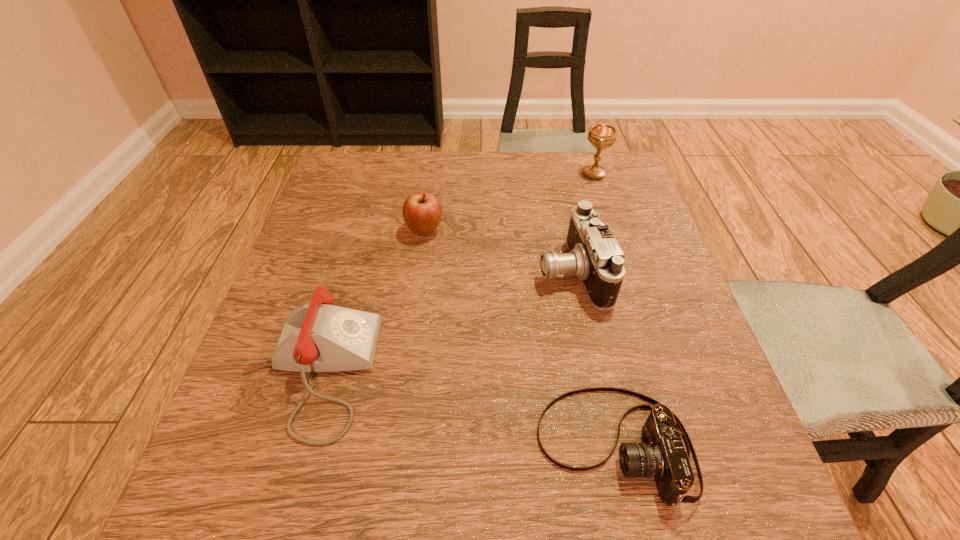
This screenshot has height=540, width=960. Identify the location of the farthest object. (601, 136).

Identify the location of the taller camera. (595, 257).

Where is `the second object from left to right`? the second object from left to right is located at coordinates tap(422, 212).

Where is `telephone`? The height and width of the screenshot is (540, 960). telephone is located at coordinates (320, 337).

At what (x,y) coordinates should I click in order to perform the action: click on the fourth tallest object. Please return your answer as a coordinate pair (x, y). The image size is (960, 540). Looking at the image, I should click on (320, 337).

This screenshot has height=540, width=960. Identify the location of the nearer camera. (663, 456).

What are the coordinates of `the shorter camera` in the screenshot? It's located at (663, 456).

This screenshot has width=960, height=540. What are the coordinates of `free space located on the left of the farthest object` in the screenshot? It's located at (493, 173).

Image resolution: width=960 pixels, height=540 pixels. I want to click on free location located at the lens of the farther camera, so pos(425,272).

Image resolution: width=960 pixels, height=540 pixels. I want to click on free region located 0.140m at the lens of the farther camera, so click(x=472, y=272).